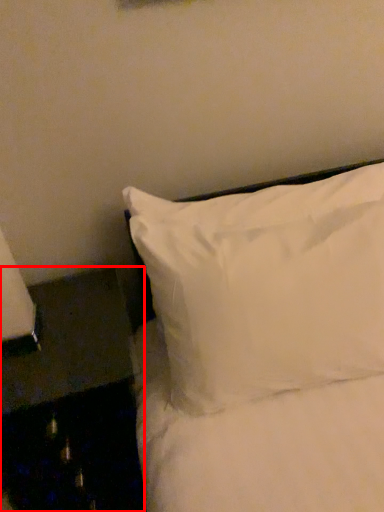
Question: From the image's perspective, where is furniture (annotated by the red box) located in relation to pillow in the image?

Choices:
 (A) above
 (B) below

Answer: (B)